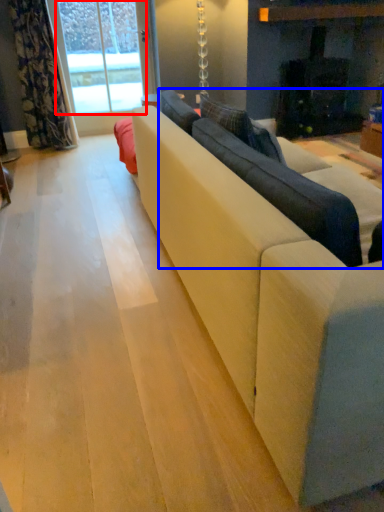
Question: Which of the following is the closest to the observer, window screen (highlighted by a red box) or couch (highlighted by a blue box)?

Choices:
 (A) window screen
 (B) couch

Answer: (B)